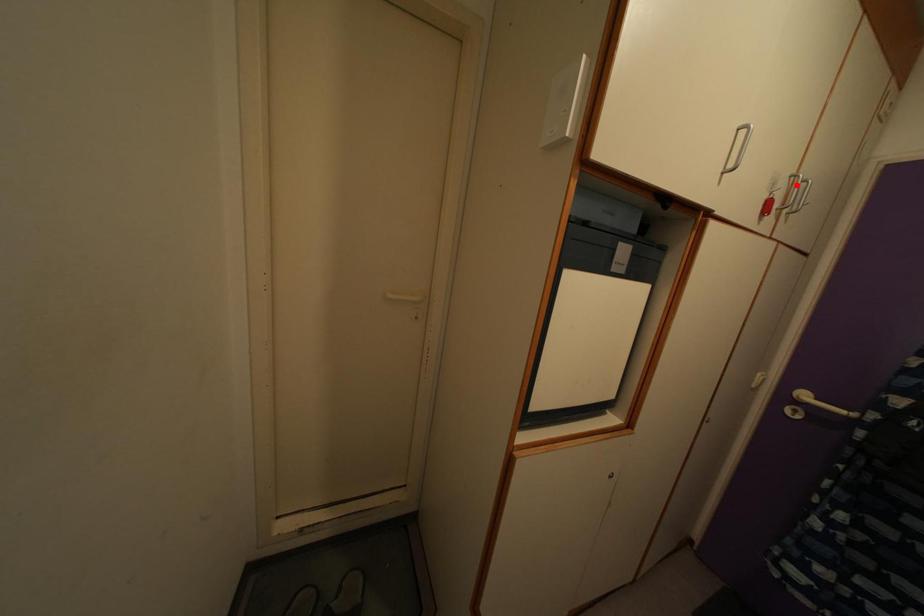
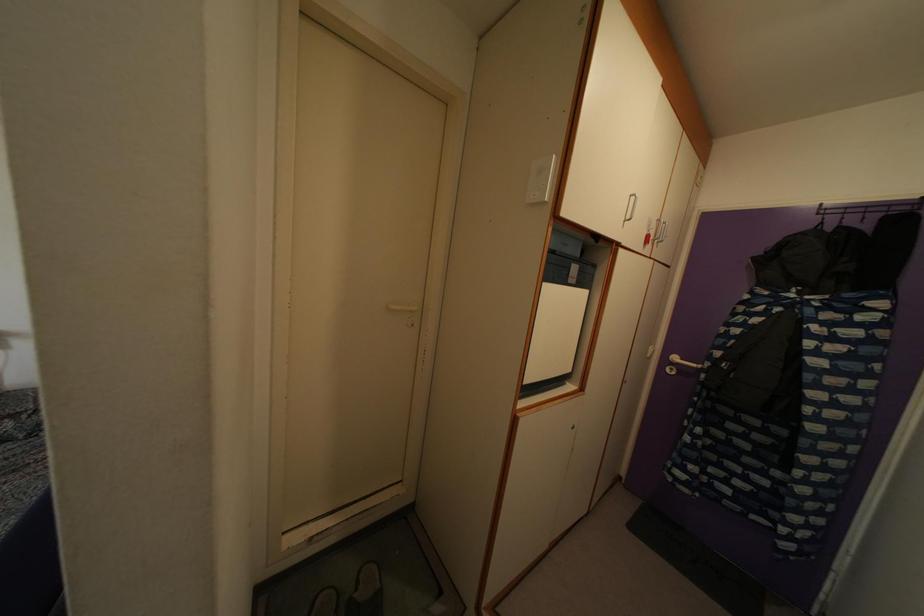
Find the pixel in the second image that matches the highlighted location in the first image.

(662, 229)